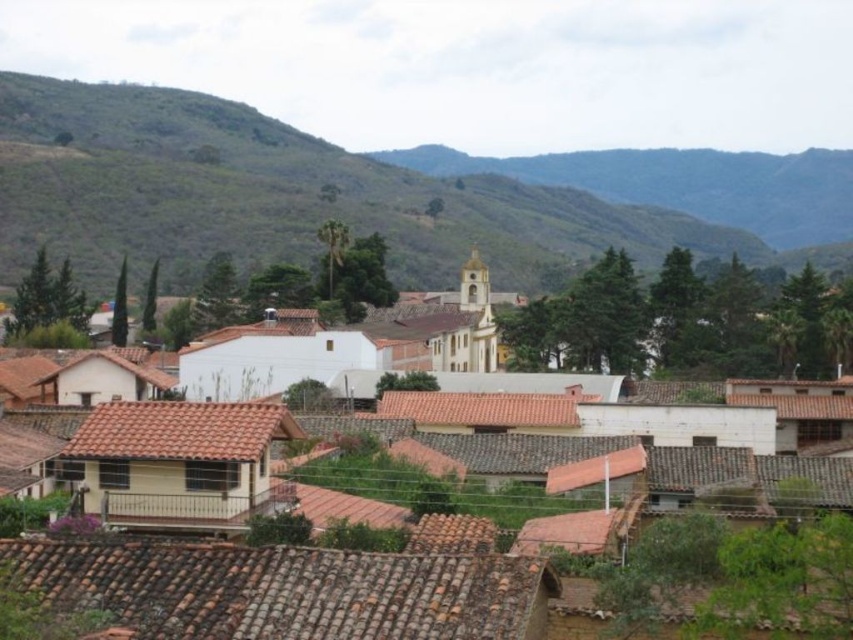
You are an architect designing a new park in the town. You need to place a statue that requires a space wider than the white matte building at center. Would the green grassy hillside at upper center provide enough width for this statue?

The white matte building at center is narrower than the green grassy hillside at upper center. Since the statue requires a space wider than the building, the green grassy hillside at upper center has sufficient width to accommodate the statue.

You are standing in the town square and want to reach the point marked at coordinates point (410, 630). Given that the distance from your current position to that point is 21.33 meters, can you estimate how far you need to walk to reach it?

The point (410, 630) is 21.33 meters away from your current position, so you need to walk approximately 21.33 meters to reach it.

You are an architect examining the town layout. You notice the white matte building at center and the green grassy hillside at upper center. Which structure is closer to the observer based on their spatial positioning?

The white matte building at center is closer to the observer since it is positioned in front of the green grassy hillside at upper center.